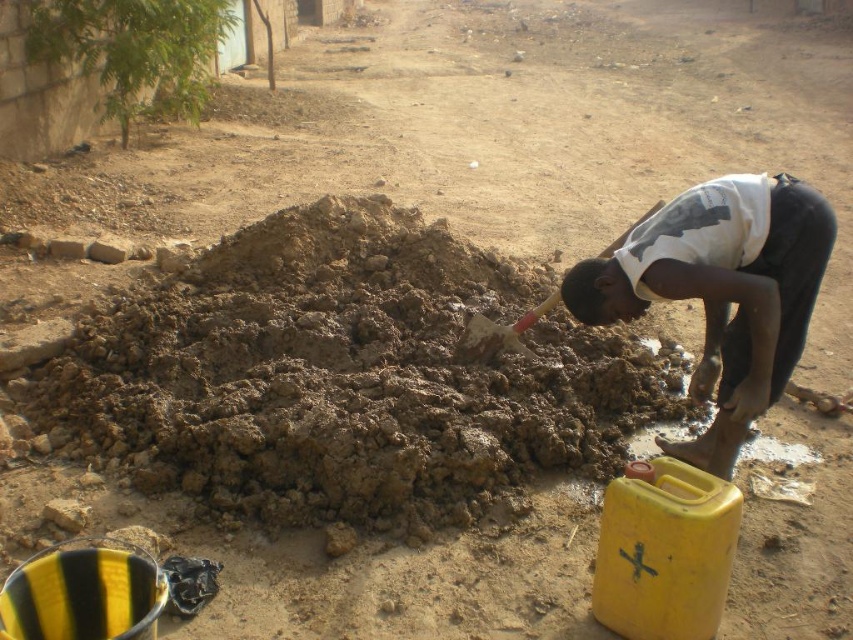
You are a construction worker who needs to place a new light pole at the exact location of the dark gray concrete squat at lower right. The coordinates given are point (720,291). Can you confirm if this point is indeed the location of the dark gray concrete squat at lower right?

Yes, the point (720,291) indicates the location of the dark gray concrete squat at lower right.

You are a construction worker who needs to know which structure is taller between the brown clay mound at center and the dark gray concrete squat at lower right. Can you determine which one is taller?

The brown clay mound at center is much taller than the dark gray concrete squat at lower right, so the brown clay mound at center is taller.

You are a construction worker needing to access the dark gray concrete squat at lower right. Can you reach it without moving the brown clay mound at center?

The dark gray concrete squat at lower right is behind the brown clay mound at center, so you cannot reach it without moving the brown clay mound at center.